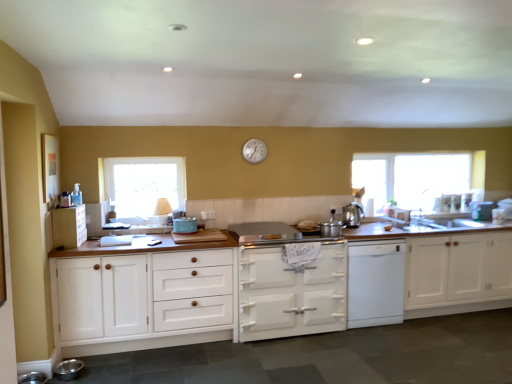
This screenshot has width=512, height=384. I want to click on vacant space to the right of metallic stainless steel bowl at lower left, acting as the 5th appliance starting from the top, so click(95, 375).